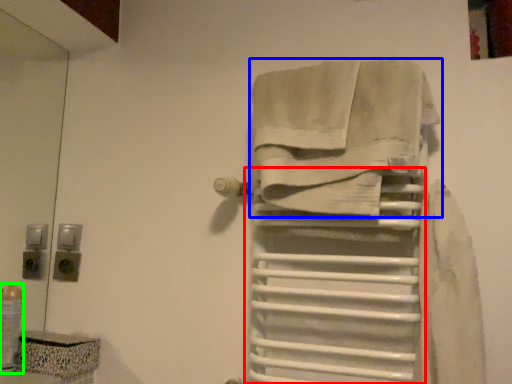
Question: Considering the real-world distances, which object is closest to shelf (highlighted by a red box)? towel (highlighted by a blue box) or toiletry (highlighted by a green box).

Choices:
 (A) towel
 (B) toiletry

Answer: (A)